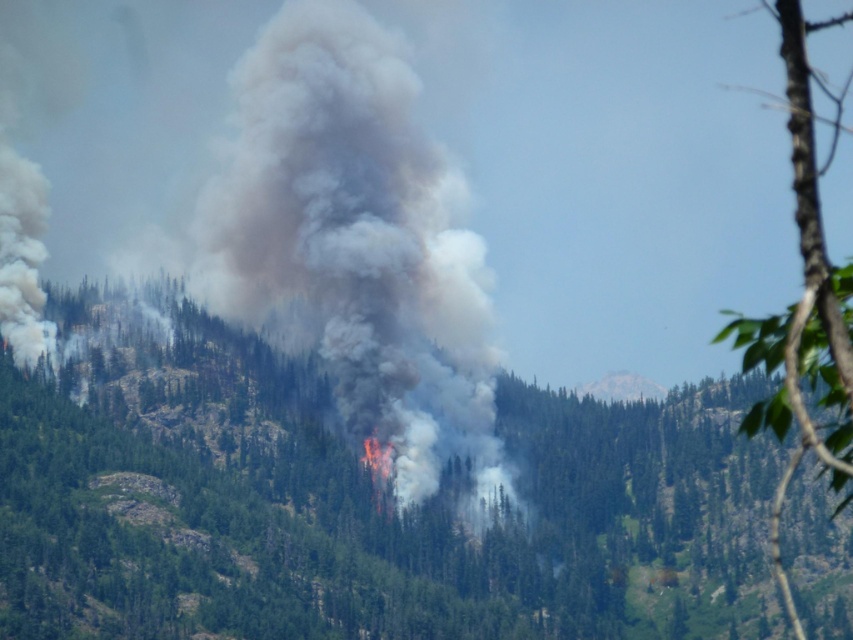
Question: Is green leafy tree at center behind gray/dense smoke at center?

Choices:
 (A) yes
 (B) no

Answer: (B)

Question: Is green leafy tree at center smaller than gray/dense smoke at center?

Choices:
 (A) no
 (B) yes

Answer: (A)

Question: Is green leafy tree at center thinner than gray/dense smoke at center?

Choices:
 (A) yes
 (B) no

Answer: (B)